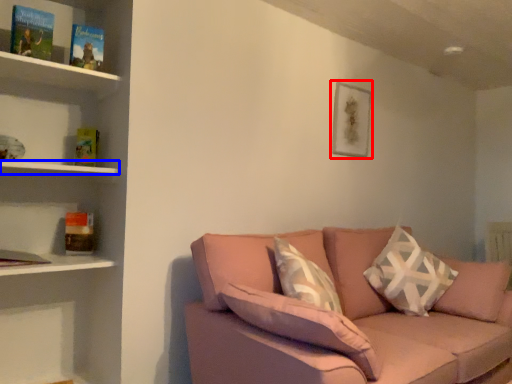
Question: Which of the following is the closest to the observer, picture frame (highlighted by a red box) or shelf (highlighted by a blue box)?

Choices:
 (A) picture frame
 (B) shelf

Answer: (B)